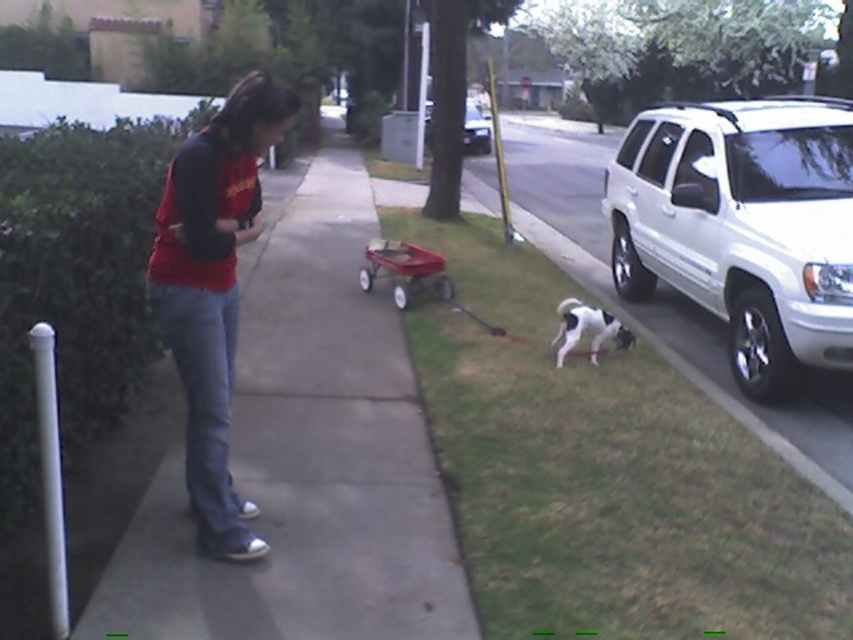
Question: Does matte red shirt at center have a smaller size compared to metallic red wagon at center?

Choices:
 (A) yes
 (B) no

Answer: (B)

Question: From the image, what is the correct spatial relationship of smooth concrete sidewalk at center in relation to matte red shirt at center?

Choices:
 (A) below
 (B) above

Answer: (A)

Question: Which point is farther from the camera taking this photo?

Choices:
 (A) (599, 314)
 (B) (430, 120)

Answer: (B)

Question: Considering the relative positions of white glossy suv at right and white and black fur dog at lower right in the image provided, where is white glossy suv at right located with respect to white and black fur dog at lower right?

Choices:
 (A) above
 (B) below

Answer: (A)

Question: Which object is positioned closest to the metallic red wagon at center?

Choices:
 (A) white and black fur dog at lower right
 (B) matte red shirt at center
 (C) white glossy suv at center
 (D) white glossy suv at right

Answer: (A)

Question: Which point is farther to the camera?

Choices:
 (A) matte red shirt at center
 (B) white glossy suv at center

Answer: (B)